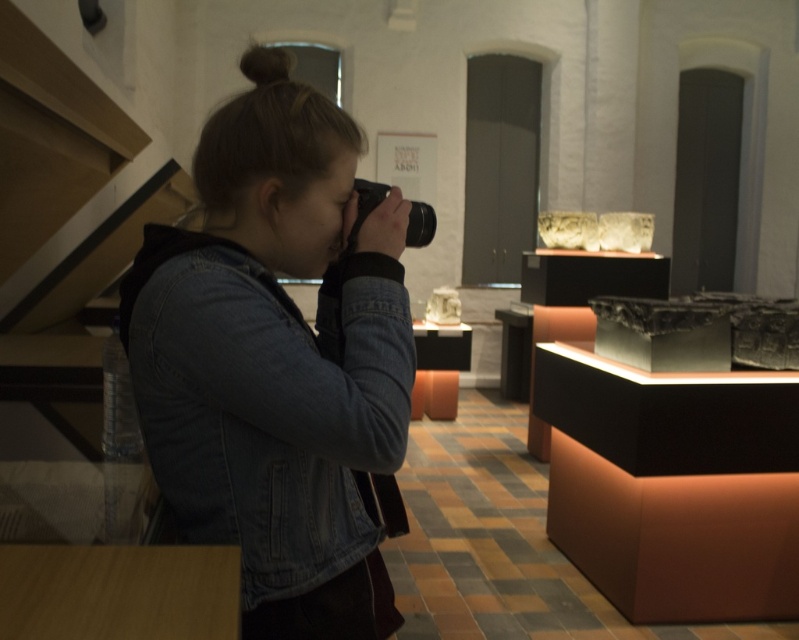
Can you confirm if denim jacket at center is positioned to the right of black plastic camera at center?

Incorrect, denim jacket at center is not on the right side of black plastic camera at center.

Is point (406, 397) positioned behind point (416, 220)?

No.

The image size is (799, 640). Identify the location of denim jacket at center. (268, 403).

Find the location of a particular element. The height and width of the screenshot is (640, 799). denim jacket at center is located at coordinates (268, 403).